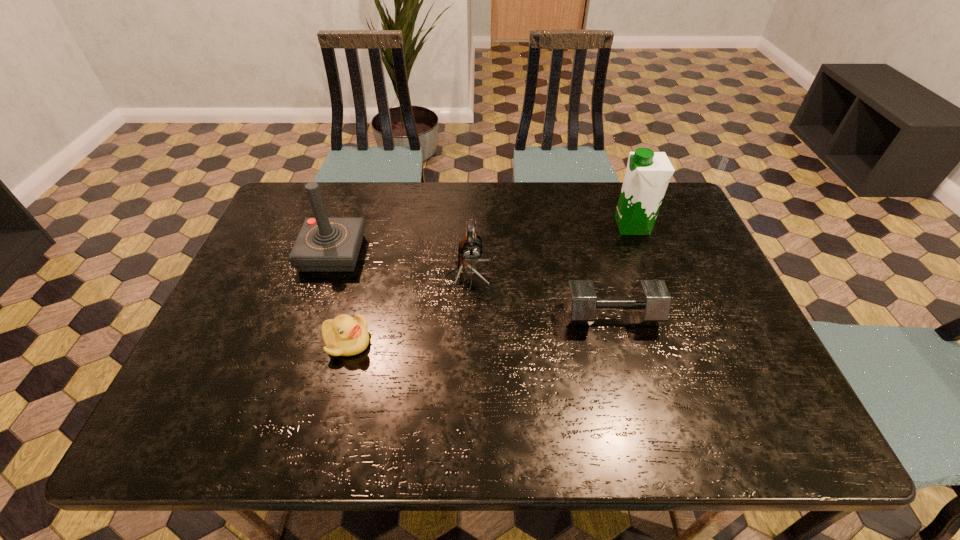
This screenshot has height=540, width=960. I want to click on soya milk, so click(x=648, y=173).

You are a GUI agent. You are given a task and a screenshot of the screen. Output one action in this format:
    pyautogui.click(x=<x>, y=<y>)
    Task: Click on the joystick
    The height and width of the screenshot is (540, 960).
    Given the screenshot: What is the action you would take?
    pyautogui.click(x=323, y=244)

Locate an element on the screen. This screenshot has height=540, width=960. the third tallest object is located at coordinates (470, 249).

Locate an element on the screen. The image size is (960, 540). earphone is located at coordinates (470, 249).

Where is `dumbbell`? dumbbell is located at coordinates pyautogui.click(x=650, y=304).

Where is `duckling`? duckling is located at coordinates (344, 335).

The width and height of the screenshot is (960, 540). Find the location of `vacant space located 0.200m on the front-facing side of the soya milk`. vacant space located 0.200m on the front-facing side of the soya milk is located at coordinates (546, 226).

At what (x,y) coordinates should I click in order to perform the action: click on free region located on the front-facing side of the soya milk. Please return your answer as a coordinate pair (x, y). This screenshot has width=960, height=540. Looking at the image, I should click on (587, 226).

This screenshot has width=960, height=540. I want to click on free spot located on the front-facing side of the soya milk, so click(514, 226).

The width and height of the screenshot is (960, 540). What are the coordinates of `vacant position located 0.050m on the rectangular base of the joystick` in the screenshot? It's located at (321, 288).